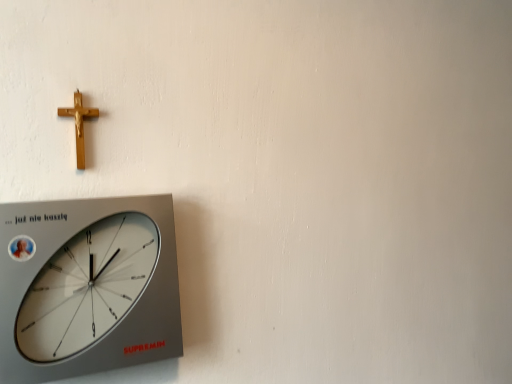
Question: Would you say silver metallic wall clock at lower left is to the left or to the right of gold polished crucifix at upper left in the picture?

Choices:
 (A) right
 (B) left

Answer: (A)

Question: In the image, is silver metallic wall clock at lower left positioned in front of or behind gold polished crucifix at upper left?

Choices:
 (A) front
 (B) behind

Answer: (A)

Question: Does point coord(9,359) appear closer or farther from the camera than point coord(81,99)?

Choices:
 (A) farther
 (B) closer

Answer: (B)

Question: Considering their positions, is gold polished crucifix at upper left located in front of or behind silver metallic wall clock at lower left?

Choices:
 (A) behind
 (B) front

Answer: (A)

Question: Which is correct: gold polished crucifix at upper left is inside silver metallic wall clock at lower left, or outside of it?

Choices:
 (A) inside
 (B) outside

Answer: (B)

Question: From the image's perspective, is gold polished crucifix at upper left positioned above or below silver metallic wall clock at lower left?

Choices:
 (A) below
 (B) above

Answer: (B)

Question: In the image, is gold polished crucifix at upper left on the left side or the right side of silver metallic wall clock at lower left?

Choices:
 (A) left
 (B) right

Answer: (A)